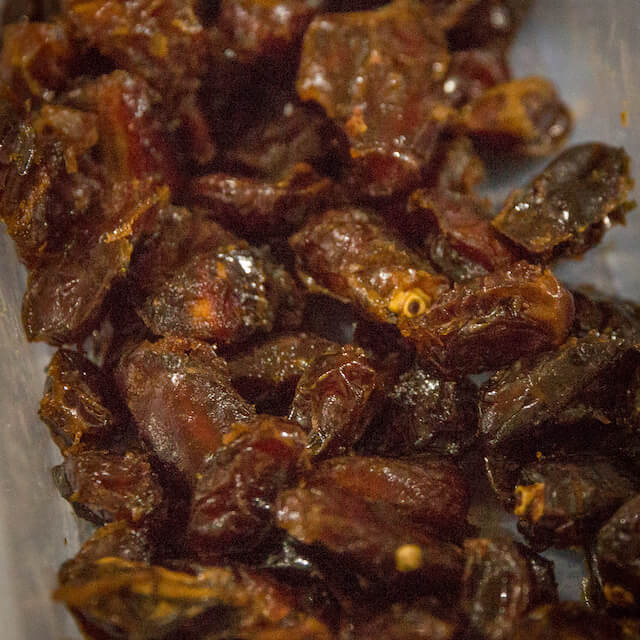
This screenshot has height=640, width=640. Identify the location of bowl. (x=48, y=536).